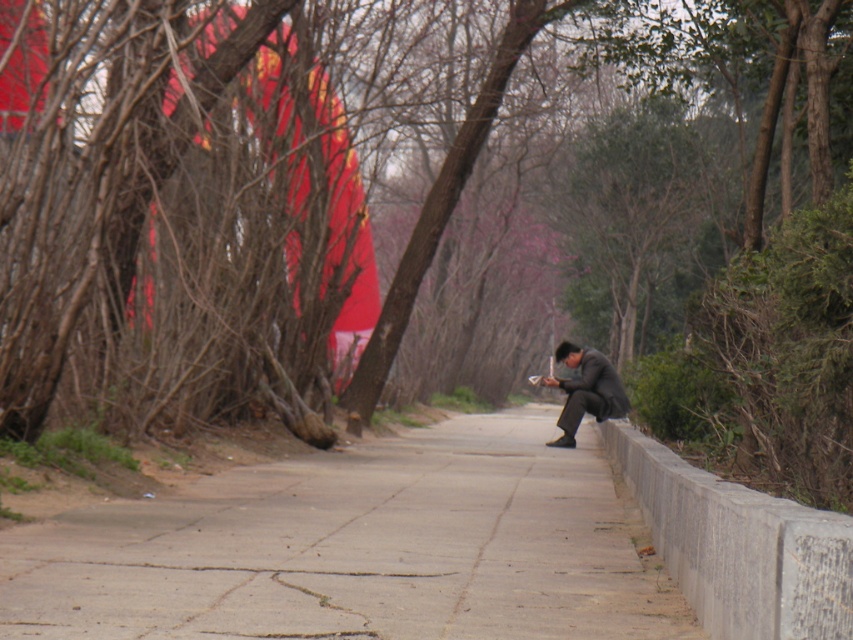
You are standing at the center of the pathway and notice a brown bark tree at center. Based on the coordinates provided, is the tree closer to the left or right side of the path?

The brown bark tree at center is located at point 0.294 on the x and y axis, which places it closer to the left side of the path compared to the right side.

You are standing at the point with coordinates point (213, 540) and want to walk to the point with coordinates point (613, 12). Given the scene described, will you be able to see the destination point from your current position?

Point (613, 12) is behind point (213, 540), so you will not be able to see the destination point from your current position.